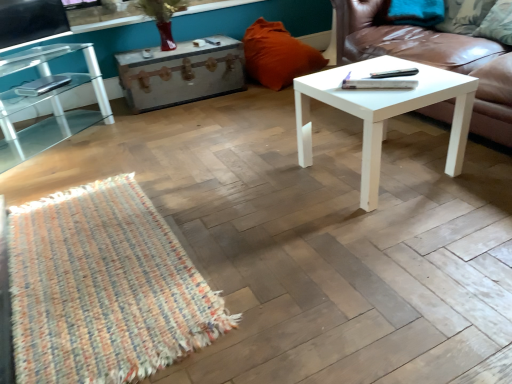
Find the location of `vacant space situated above white matte coffee table at center (from a real-world perspective)`. vacant space situated above white matte coffee table at center (from a real-world perspective) is located at coordinates (374, 74).